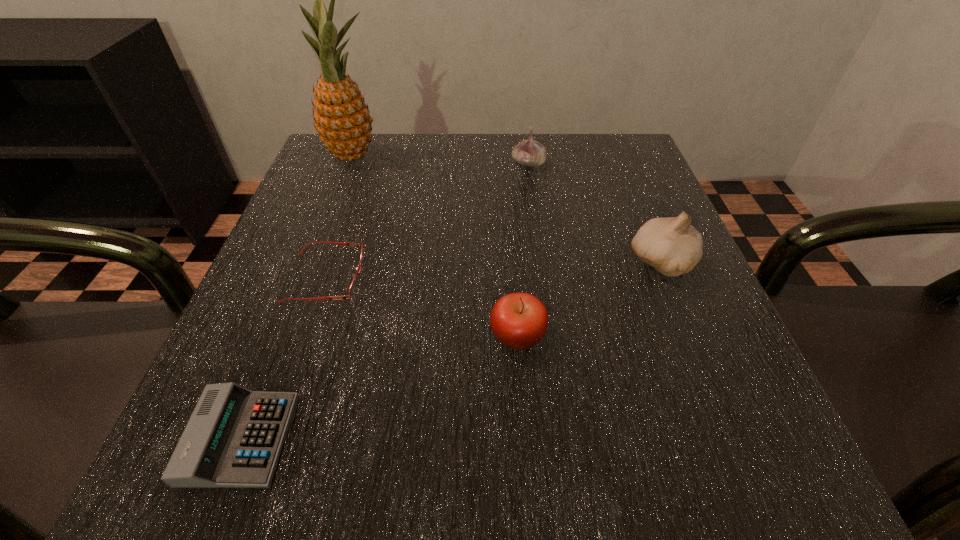
Select which object appears as the closest to the fifth farthest object. Please provide its 2D coordinates. Your answer should be formatted as a tuple, i.e. [(x, y)], where the tuple contains the x and y coordinates of a point satisfying the conditions above.

[(672, 246)]

The image size is (960, 540). I want to click on object that is the fifth closest to the spectacles, so click(672, 246).

In order to click on vacant space that satisfies the following two spatial constraints: 1. on the lenses of the fifth farthest object; 2. on the left side of the spectacles in this screenshot , I will do `click(307, 336)`.

Where is `free spot that satisfies the following two spatial constraints: 1. on the back side of the apple; 2. on the left side of the calculator`? Image resolution: width=960 pixels, height=540 pixels. free spot that satisfies the following two spatial constraints: 1. on the back side of the apple; 2. on the left side of the calculator is located at coordinates (280, 336).

Find the location of a particular element. The width and height of the screenshot is (960, 540). free spot that satisfies the following two spatial constraints: 1. on the back side of the nearest object; 2. on the right side of the shorter garlic is located at coordinates (347, 164).

This screenshot has height=540, width=960. I want to click on vacant area that satisfies the following two spatial constraints: 1. on the back side of the calculator; 2. on the left side of the second nearest object, so click(280, 336).

At what (x,y) coordinates should I click in order to perform the action: click on blank space that satisfies the following two spatial constraints: 1. on the back side of the right garlic; 2. on the left side of the calculator. Please return your answer as a coordinate pair (x, y). Looking at the image, I should click on (308, 262).